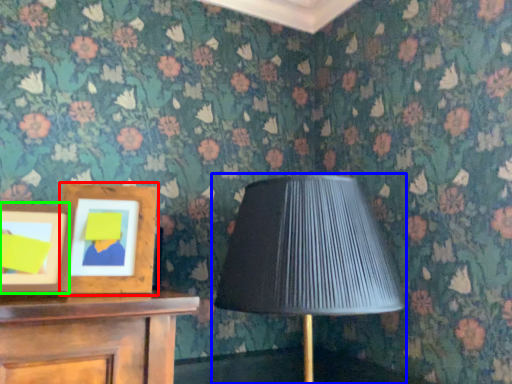
Question: Estimate the real-world distances between objects in this image. Which object is closer to picture frame (highlighted by a red box), lamp (highlighted by a blue box) or picture frame (highlighted by a green box)?

Choices:
 (A) lamp
 (B) picture frame

Answer: (B)